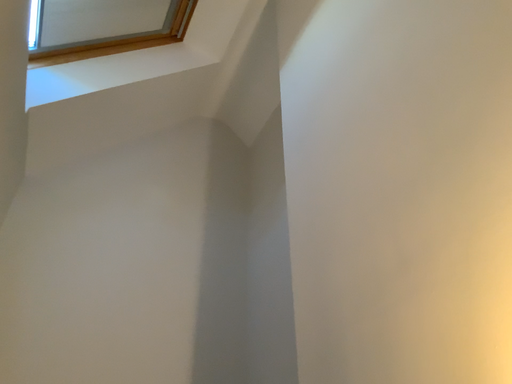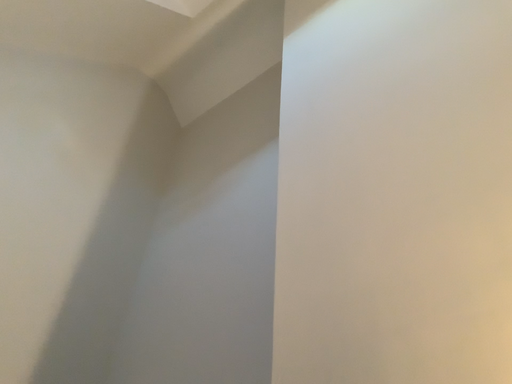
Question: Which way did the camera rotate in the video?

Choices:
 (A) rotated right
 (B) rotated left

Answer: (A)